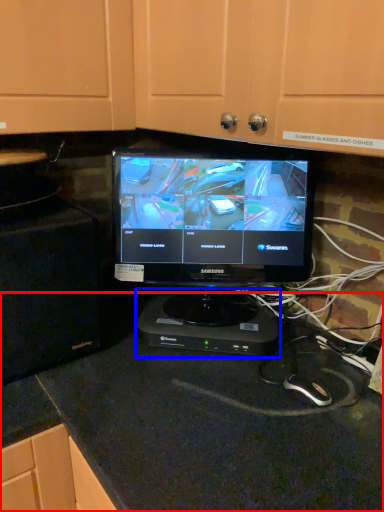
Question: Which object appears farthest to the camera in this image, counter top (highlighted by a red box) or appliance (highlighted by a blue box)?

Choices:
 (A) counter top
 (B) appliance

Answer: (B)